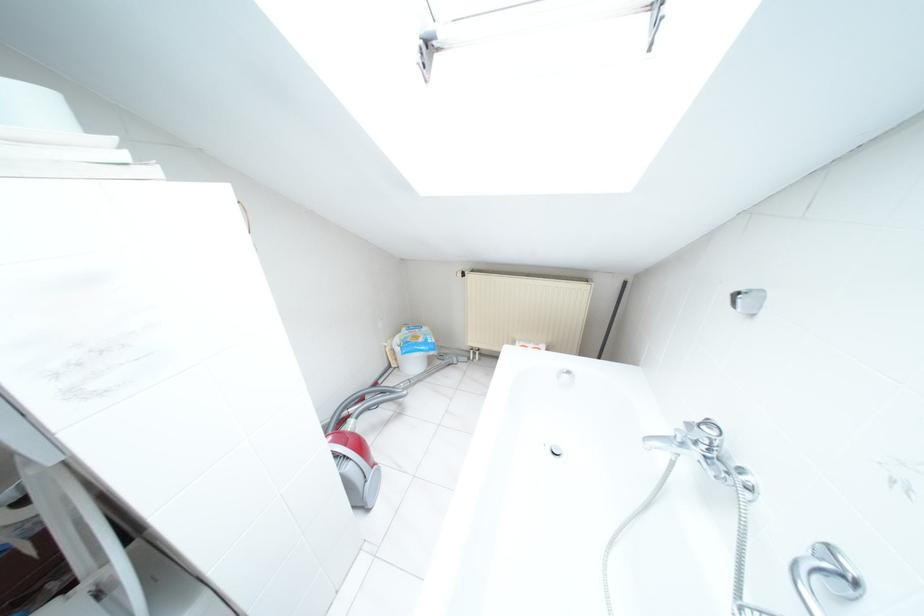
This screenshot has height=616, width=924. I want to click on white cleaning container, so click(412, 349).